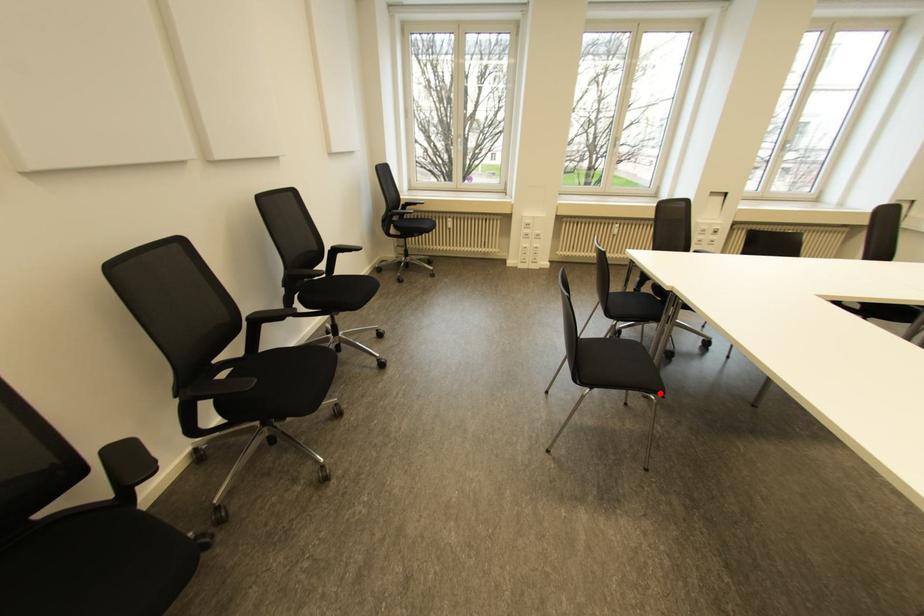
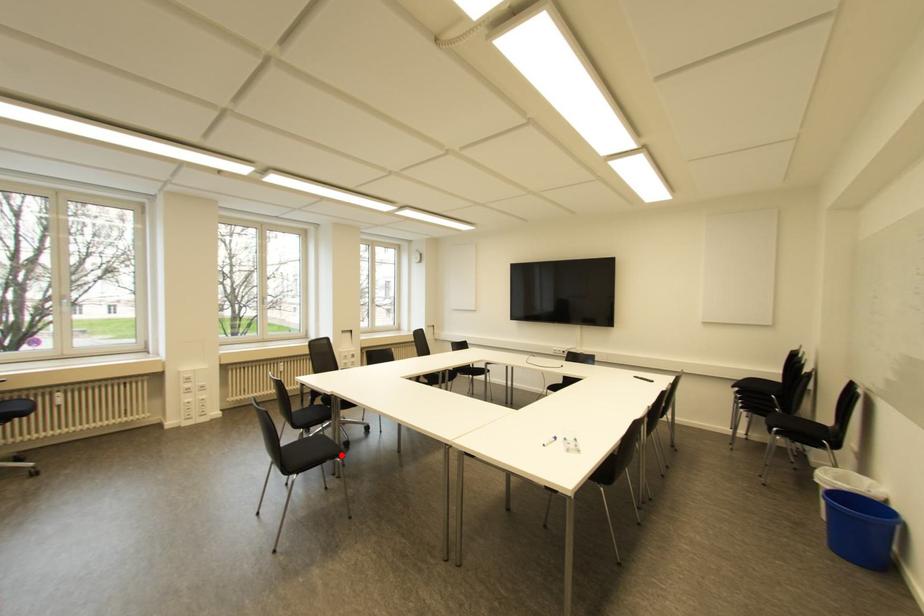
I am providing you with two images of the same scene from different viewpoints. A red point is marked on the first image and another point is marked on the second image. Does the point marked in image1 correspond to the same location as the one in image2?

Yes